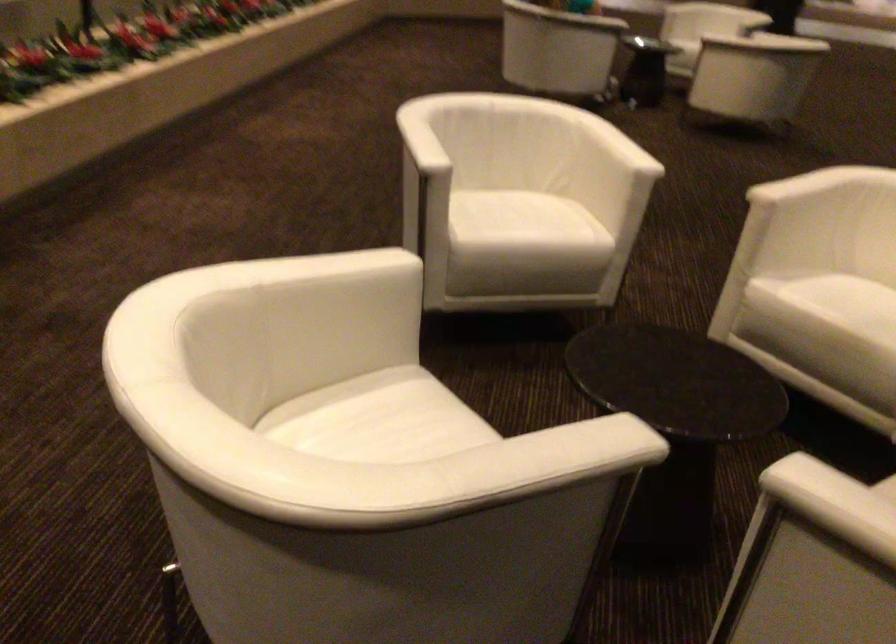
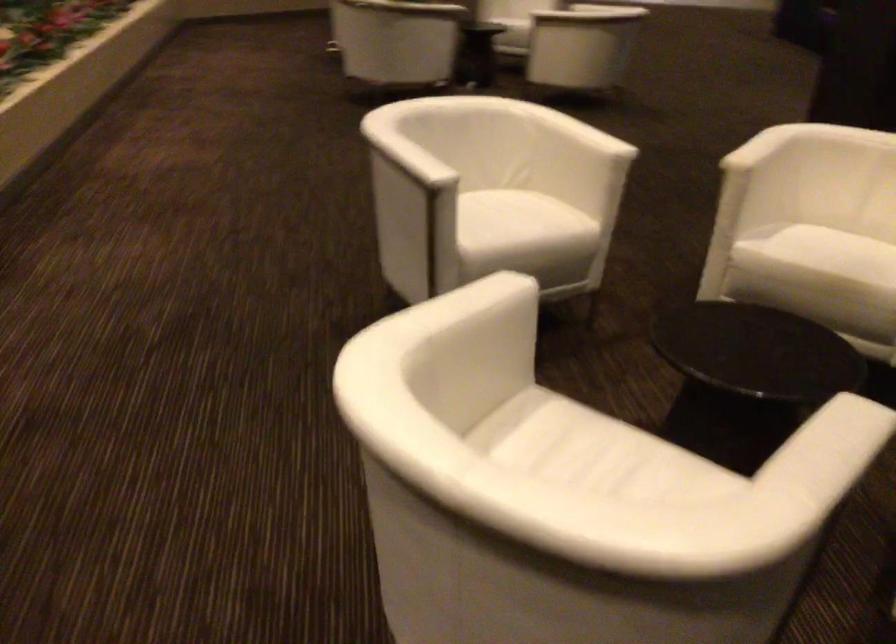
In the second image, find the point that corresponds to point 409,140 in the first image.

(406, 158)